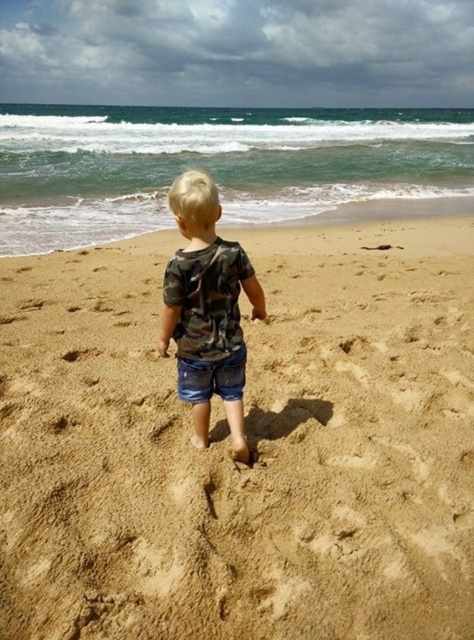
Question: Does brown sandy beach at center have a greater width compared to camo fabric shirt at center?

Choices:
 (A) yes
 (B) no

Answer: (A)

Question: Which point is farther from the camera taking this photo?

Choices:
 (A) (164, 336)
 (B) (52, 609)

Answer: (A)

Question: Can you confirm if brown sandy beach at center is positioned above camo fabric shirt at center?

Choices:
 (A) yes
 (B) no

Answer: (B)

Question: Which point is closer to the camera taking this photo?

Choices:
 (A) (183, 346)
 (B) (57, 360)

Answer: (A)

Question: Can you confirm if brown sandy beach at center is positioned below camo fabric shirt at center?

Choices:
 (A) no
 (B) yes

Answer: (B)